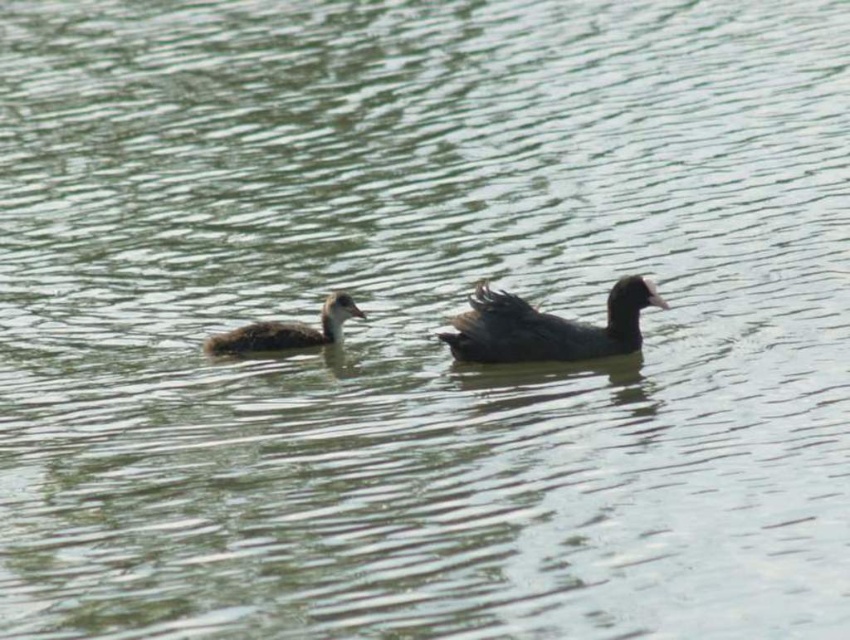
Consider the image. Does black matte duck at center appear on the left side of brown matte duckling at center?

Incorrect, black matte duck at center is not on the left side of brown matte duckling at center.

Is point (530, 308) more distant than point (355, 310)?

No, (530, 308) is in front of (355, 310).

Find the location of a particular element. The width and height of the screenshot is (850, 640). black matte duck at center is located at coordinates tap(547, 326).

Locate an element on the screen. Image resolution: width=850 pixels, height=640 pixels. black matte duck at center is located at coordinates (547, 326).